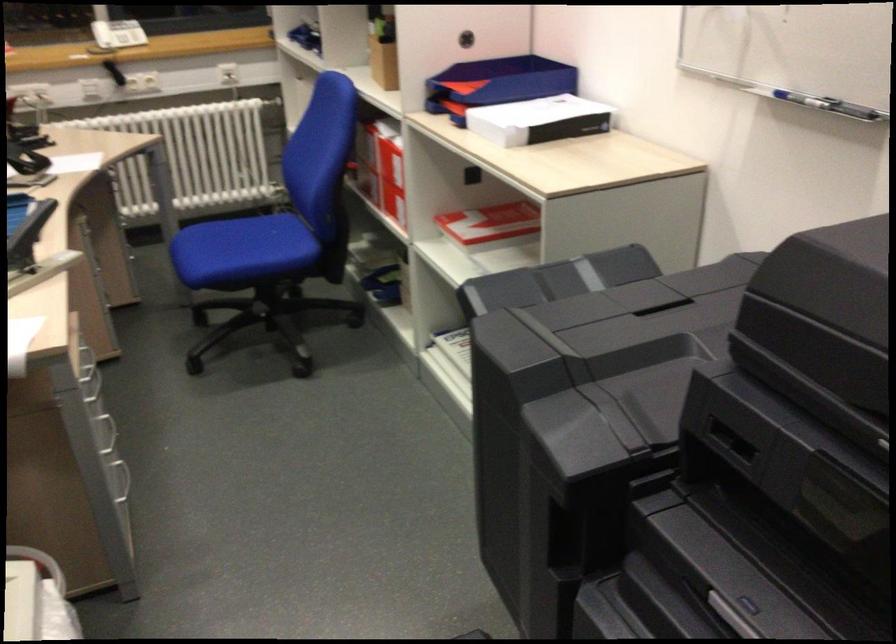
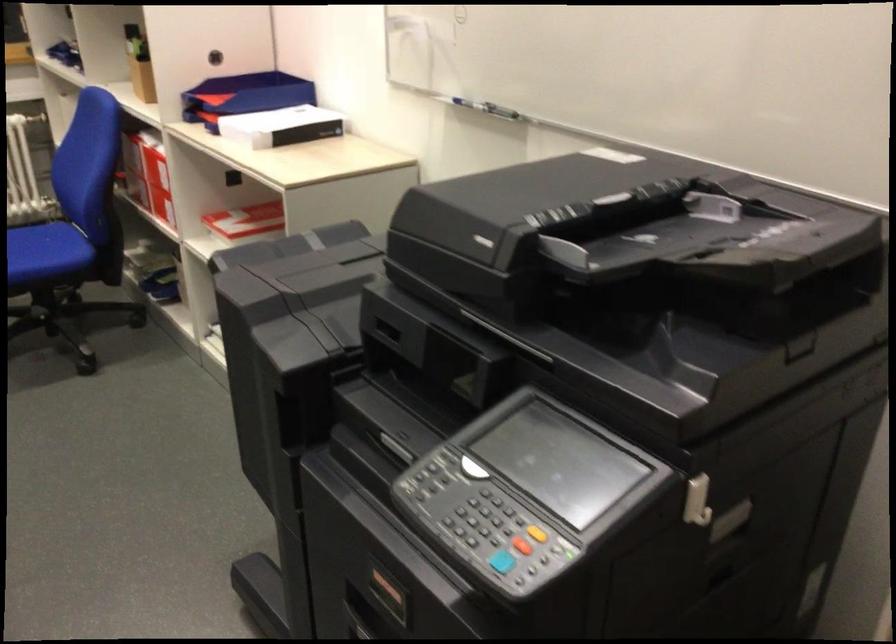
Question: What movement of the cameraman would produce the second image?

Choices:
 (A) Left
 (B) Right
 (C) Forward
 (D) Backward

Answer: (D)